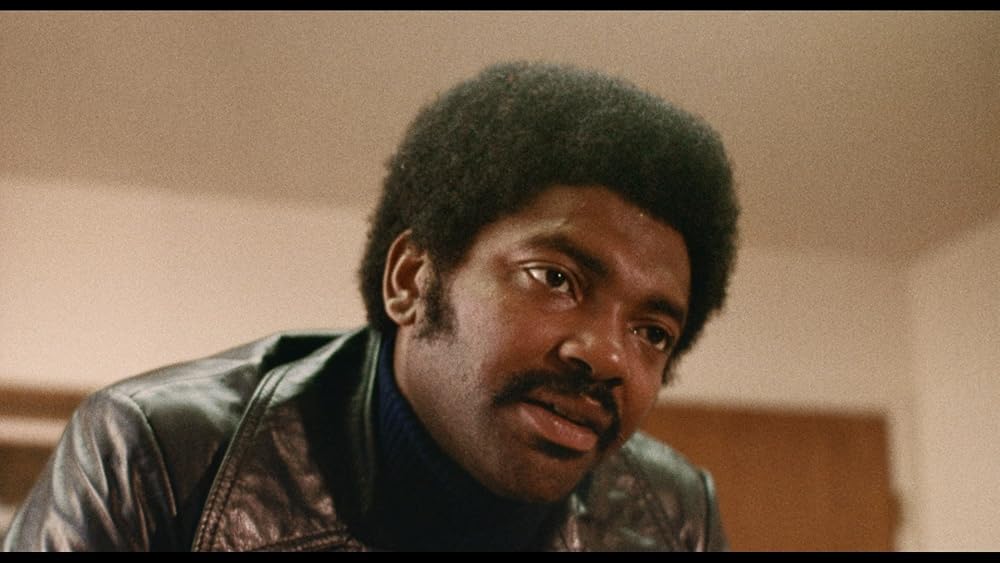
This screenshot has width=1000, height=563. I want to click on door, so click(792, 476).